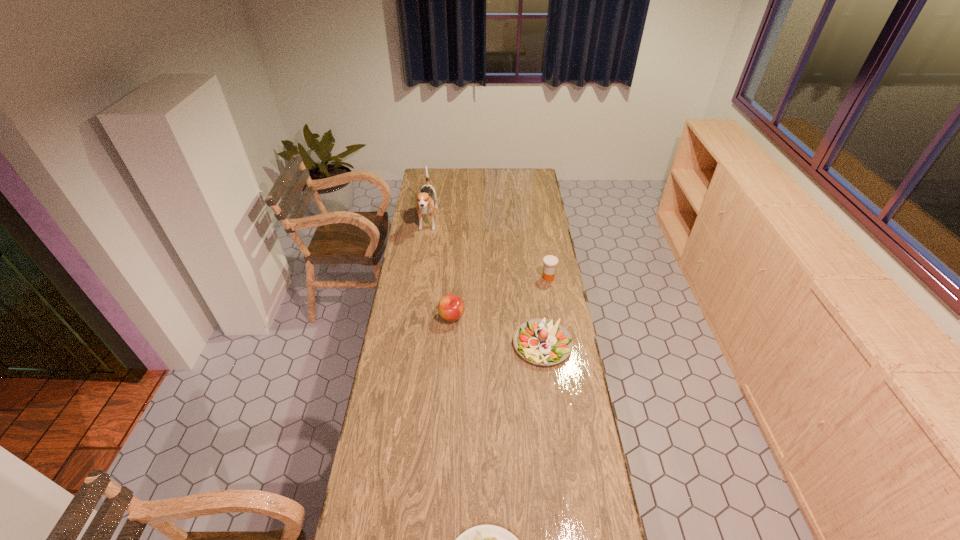
This screenshot has height=540, width=960. Identify the location of vacant position located on the front of the apple. (447, 394).

Identify the location of free region located on the back of the second shortest object. (532, 262).

You are a GUI agent. You are given a task and a screenshot of the screen. Output one action in this format:
    pyautogui.click(x=<x>, y=<y>)
    Task: Click on the object located in the left edge section of the desktop
    Image resolution: width=960 pixels, height=540 pixels.
    Given the screenshot: What is the action you would take?
    pyautogui.click(x=424, y=203)

This screenshot has width=960, height=540. I want to click on medicine positioned at the right edge, so click(x=550, y=262).

Locate an element on the screen. Image resolution: width=960 pixels, height=540 pixels. salad plate positioned at the right edge is located at coordinates (541, 341).

This screenshot has height=540, width=960. Find the location of `free space at the far edge of the desktop`. free space at the far edge of the desktop is located at coordinates (457, 174).

This screenshot has height=540, width=960. I want to click on vacant area at the left edge, so tap(397, 370).

Locate an element on the screen. The image size is (960, 540). vacant point at the right edge is located at coordinates (549, 222).

This screenshot has height=540, width=960. I want to click on free area in between the leftmost object and the apple, so click(440, 269).

The width and height of the screenshot is (960, 540). I want to click on vacant area that lies between the apple and the taller salad plate, so (x=497, y=330).